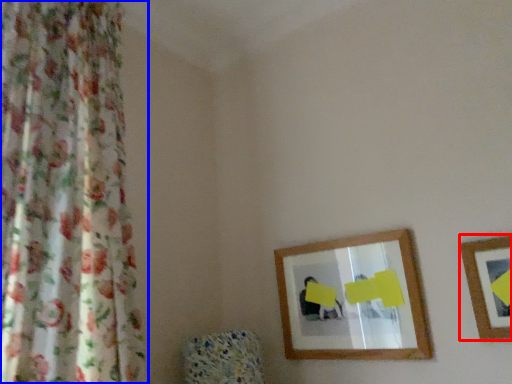
Question: Which object appears closest to the camera in this image, picture frame (highlighted by a red box) or curtain (highlighted by a blue box)?

Choices:
 (A) picture frame
 (B) curtain

Answer: (B)